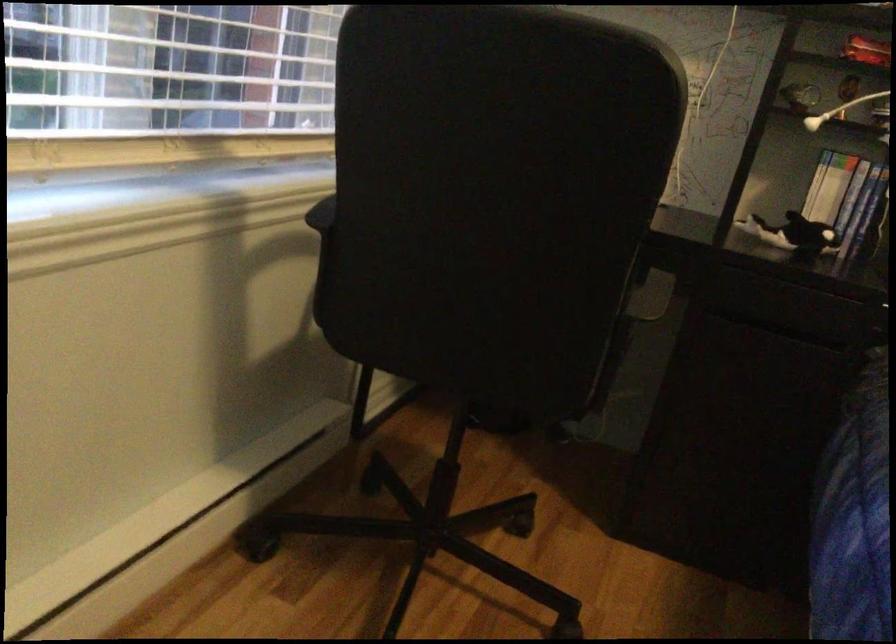
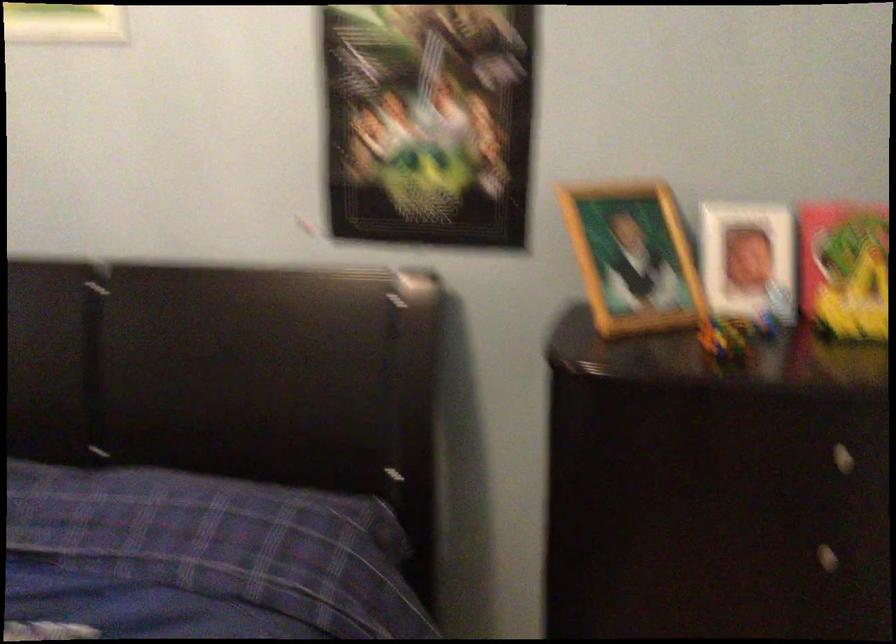
Question: Which direction would the cameraman need to move to produce the second image? Reply with the corresponding letter.

Choices:
 (A) Left
 (B) Right
 (C) Forward
 (D) Backward

Answer: (B)